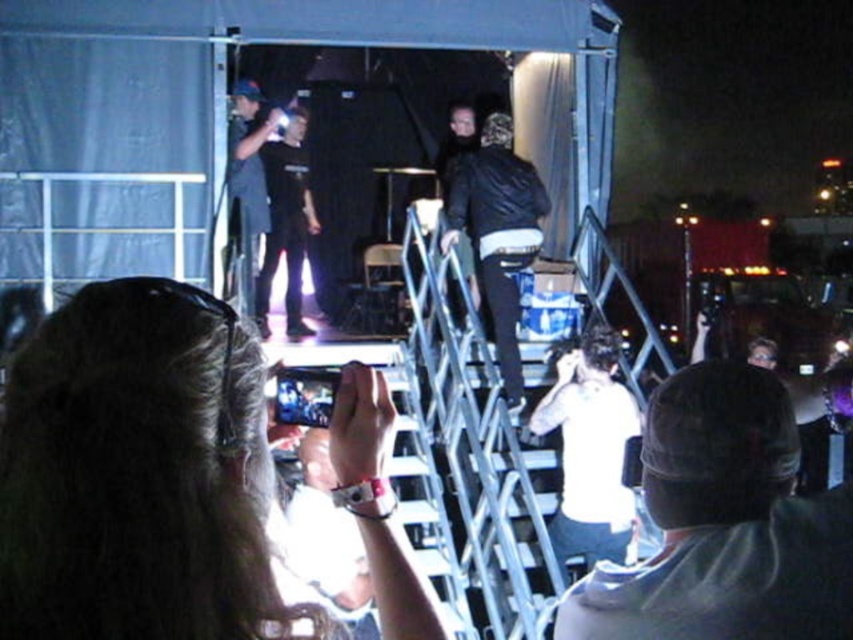
You are a photographer at the event and need to place a camera bag on the ground. The camera bag is the same size as the black leather jacket at center. Can you fit it between the silver metallic ladder at center and the edge of the stage?

The silver metallic ladder at center has a larger size compared to black leather jacket at center. Since the camera bag is the same size as the black leather jacket at center, it should fit between the silver metallic ladder at center and the edge of the stage, as there is sufficient space given the ladder is larger and likely occupies more area.

You are a photographer trying to capture the stage from your current position. You notice the gray fabric cap at upper right and the black leather jacket at center. Which object is closer to you, the photographer?

The gray fabric cap at upper right is closer to the viewer than the black leather jacket at center, so the gray fabric cap at upper right is closer to you.